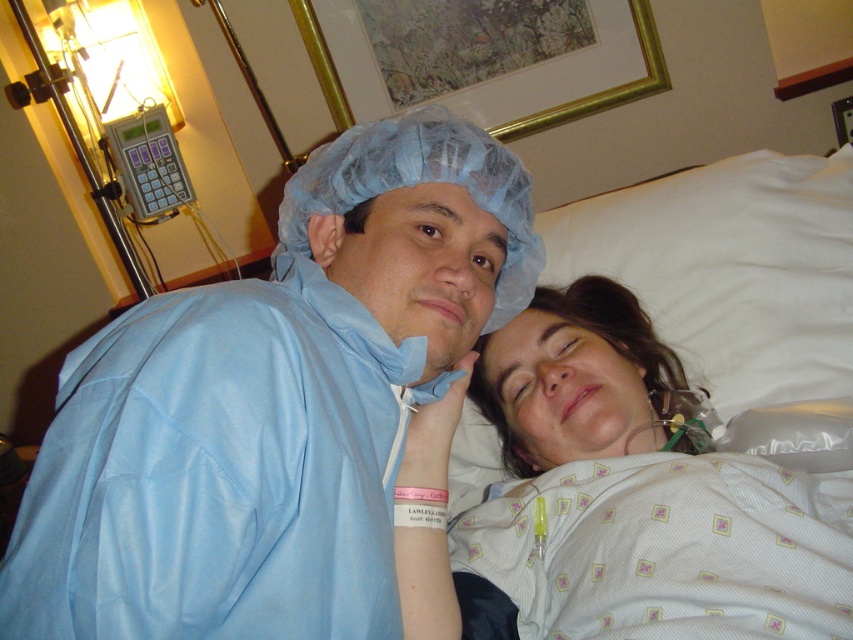
You are a photographer taking a picture of the scene. You need to focus on both the point at (100, 337) and the point at (451, 524). Which point should you focus on first to ensure both are in sharp focus?

You should focus on point (100, 337) first because it is closer to the camera than point (451, 524). By focusing on the closer point, the farther point will also be in sharp focus due to the depth of field.

You are a nurse in the hospital. You need to place a medical device at point [273,404]. Which object is located at that point?

The point [273,404] is on the blue matte hospital gown at left.